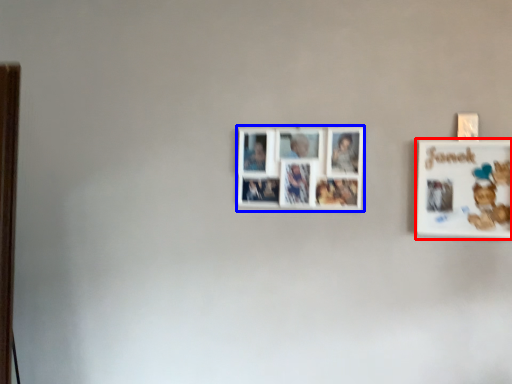
Question: Which of the following is the closest to the observer, picture frame (highlighted by a red box) or picture frame (highlighted by a blue box)?

Choices:
 (A) picture frame
 (B) picture frame

Answer: (A)